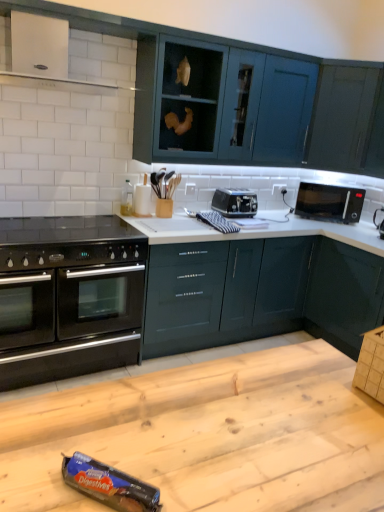
The image size is (384, 512). What are the coordinates of `glossy dark teal cabinets at center, which appears as the 3th cabinetry when viewed from the top` in the screenshot? It's located at (261, 293).

Describe the element at coordinates (348, 118) in the screenshot. The height and width of the screenshot is (512, 384). I see `glossy dark teal cabinet at upper right, marked as the fourth cabinetry in a bottom-to-top arrangement` at that location.

How much space does satin black toaster at center, which is the 1th appliance in back-to-front order, occupy vertically?

8.65 inches.

Find the location of a particular element. glossy dark teal cabinets at center, the second cabinetry ordered from the bottom is located at coordinates (261, 293).

Which of these two, glossy dark teal cabinets at center, the second cabinetry ordered from the bottom, or black plastic microwave at upper right, which is the first appliance from right to left, is smaller?

Smaller between the two is black plastic microwave at upper right, which is the first appliance from right to left.

Identify the location of appliance that is the 3rd object above the glossy dark teal cabinets at center, which appears as the 3th cabinetry when viewed from the top (from a real-world perspective). (379, 222).

Which object is thinner, glossy dark teal cabinets at center, the second cabinetry ordered from the bottom, or black plastic microwave at upper right, positioned as the second appliance in back-to-front order?

With smaller width is black plastic microwave at upper right, positioned as the second appliance in back-to-front order.

Is point (173, 315) closer to viewer compared to point (380, 222)?

Yes.

From the picture: Is blue cardboard digestives at lower center, marked as the 1th appliance in a front-to-back arrangement, bigger than satin black toaster at center, which is the third appliance in bottom-to-top order?

Actually, blue cardboard digestives at lower center, marked as the 1th appliance in a front-to-back arrangement, might be smaller than satin black toaster at center, which is the third appliance in bottom-to-top order.

Could you tell me if blue cardboard digestives at lower center, placed as the 3th appliance when sorted from right to left, is facing satin black toaster at center, which is the 1th appliance in back-to-front order?

No, blue cardboard digestives at lower center, placed as the 3th appliance when sorted from right to left, is not turned towards satin black toaster at center, which is the 1th appliance in back-to-front order.

From the image's perspective, which is above, blue cardboard digestives at lower center, the third appliance positioned from the top, or satin black toaster at center, which is the first appliance from top to bottom?

satin black toaster at center, which is the first appliance from top to bottom.

From the image's perspective, starting from the blue cardboard digestives at lower center, marked as the third appliance in a back-to-front arrangement, which appliance is the 2nd one above? Please provide its 2D coordinates.

[(235, 202)]

Is teal glossy cabinets at upper center, the third cabinetry from the bottom, not near glossy dark green cabinet at lower right, the 1th cabinetry from the bottom?

Absolutely, teal glossy cabinets at upper center, the third cabinetry from the bottom, is distant from glossy dark green cabinet at lower right, the 1th cabinetry from the bottom.

From the image's perspective, is teal glossy cabinets at upper center, arranged as the 2th cabinetry when viewed from the top, above glossy dark green cabinet at lower right, the 1th cabinetry from the bottom?

Yes, from the image's perspective, teal glossy cabinets at upper center, arranged as the 2th cabinetry when viewed from the top, is above glossy dark green cabinet at lower right, the 1th cabinetry from the bottom.

Is teal glossy cabinets at upper center, the third cabinetry from the bottom, looking in the opposite direction of glossy dark green cabinet at lower right, which is the 4th cabinetry in top-to-bottom order?

No, teal glossy cabinets at upper center, the third cabinetry from the bottom, is not facing away from glossy dark green cabinet at lower right, which is the 4th cabinetry in top-to-bottom order.

Considering the sizes of objects brown cardboard box at lower right and black glass gas stove at lower left in the image provided, who is thinner, brown cardboard box at lower right or black glass gas stove at lower left?

brown cardboard box at lower right.

Does brown cardboard box at lower right lie in front of black glass gas stove at lower left?

Yes, brown cardboard box at lower right is closer to the viewer.

Is point (371, 332) farther from viewer compared to point (66, 237)?

No, (371, 332) is closer to viewer.

From a real-world perspective, is brown cardboard box at lower right positioned over black glass gas stove at lower left based on gravity?

Yes, from a real-world perspective, brown cardboard box at lower right is above black glass gas stove at lower left.

From the image's perspective, is glossy dark green cabinet at lower right, the 1th cabinetry from the bottom, under black plastic microwave at upper right, the second appliance in the bottom-to-top sequence?

Indeed, from the image's perspective, glossy dark green cabinet at lower right, the 1th cabinetry from the bottom, is shown beneath black plastic microwave at upper right, the second appliance in the bottom-to-top sequence.

Which point is more forward, (358, 273) or (383, 218)?

Point (358, 273)

From a real-world perspective, is glossy dark green cabinet at lower right, the 1th cabinetry from the bottom, positioned above or below black plastic microwave at upper right, the 2th appliance when ordered from front to back?

glossy dark green cabinet at lower right, the 1th cabinetry from the bottom, is below black plastic microwave at upper right, the 2th appliance when ordered from front to back.

Which is more to the right, glossy dark green cabinet at lower right, which is the 4th cabinetry in top-to-bottom order, or black plastic microwave at upper right, the 2th appliance when ordered from front to back?

Positioned to the right is black plastic microwave at upper right, the 2th appliance when ordered from front to back.

From a real-world perspective, is glossy dark teal cabinets at center, which appears as the 3th cabinetry when viewed from the top, beneath glossy dark green cabinet at lower right, which is the 4th cabinetry in top-to-bottom order?

No, from a real-world perspective, glossy dark teal cabinets at center, which appears as the 3th cabinetry when viewed from the top, is not under glossy dark green cabinet at lower right, which is the 4th cabinetry in top-to-bottom order.

Does glossy dark teal cabinets at center, the second cabinetry ordered from the bottom, have a greater width compared to glossy dark green cabinet at lower right, which is the 4th cabinetry in top-to-bottom order?

In fact, glossy dark teal cabinets at center, the second cabinetry ordered from the bottom, might be narrower than glossy dark green cabinet at lower right, which is the 4th cabinetry in top-to-bottom order.

From the image's perspective, which is below, glossy dark teal cabinets at center, which appears as the 3th cabinetry when viewed from the top, or glossy dark green cabinet at lower right, the 1th cabinetry from the bottom?

glossy dark green cabinet at lower right, the 1th cabinetry from the bottom.

Consider the image. Is glossy dark teal cabinets at center, which appears as the 3th cabinetry when viewed from the top, facing towards glossy dark green cabinet at lower right, which is the 4th cabinetry in top-to-bottom order?

Yes, glossy dark teal cabinets at center, which appears as the 3th cabinetry when viewed from the top, is facing glossy dark green cabinet at lower right, which is the 4th cabinetry in top-to-bottom order.

From a real-world perspective, which object rests below the other?

black plastic microwave at upper right, which is counted as the 3th appliance, starting from the left, is physically lower.

Is black glossy microwave at upper right facing away from black plastic microwave at upper right, which is the first appliance from right to left?

That's not correct — black glossy microwave at upper right is not looking away from black plastic microwave at upper right, which is the first appliance from right to left.

Is point (299, 207) less distant than point (379, 224)?

No, (299, 207) is behind (379, 224).

Is black glossy microwave at upper right positioned far away from black plastic microwave at upper right, which is the first appliance from right to left?

Actually, black glossy microwave at upper right and black plastic microwave at upper right, which is the first appliance from right to left, are a little close together.

There is a glossy dark teal cabinets at center, the second cabinetry ordered from the bottom. Where is `the 1st appliance above it (from the image's perspective)`? Image resolution: width=384 pixels, height=512 pixels. the 1st appliance above it (from the image's perspective) is located at coordinates (379, 222).

Starting from the blue cardboard digestives at lower center, placed as the 3th appliance when sorted from right to left, which appliance is the 1st one to the right? Please provide its 2D coordinates.

[(235, 202)]

Looking at the image, which one is located further to wooden table at center, black matte oven at lower left or black glossy microwave at upper right?

Based on the image, black glossy microwave at upper right appears to be further to wooden table at center.

When comparing their distances from glossy dark teal cabinets at center, which appears as the 3th cabinetry when viewed from the top, does brown cardboard box at lower right or black matte oven at lower left seem further?

brown cardboard box at lower right is further to glossy dark teal cabinets at center, which appears as the 3th cabinetry when viewed from the top.

From the image, which object appears to be farther from glossy dark teal cabinet at upper right, which is the 1th cabinetry from top to bottom, wooden table at center or teal glossy cabinets at upper center, the third cabinetry from the bottom?

wooden table at center is positioned further to the anchor glossy dark teal cabinet at upper right, which is the 1th cabinetry from top to bottom.

Looking at the image, which one is located closer to wooden table at center, blue cardboard digestives at lower center, which is the first appliance in bottom-to-top order, or black plastic microwave at upper right, positioned as the second appliance in back-to-front order?

blue cardboard digestives at lower center, which is the first appliance in bottom-to-top order, is positioned closer to the anchor wooden table at center.

When comparing their distances from glossy dark teal cabinet at upper right, which is the 1th cabinetry from top to bottom, does wooden table at center or black glass gas stove at lower left seem further?

wooden table at center lies further to glossy dark teal cabinet at upper right, which is the 1th cabinetry from top to bottom, than the other object.

Estimate the real-world distances between objects in this image. Which object is closer to black glossy microwave at upper right, black matte oven at lower left or wooden table at center?

black matte oven at lower left lies closer to black glossy microwave at upper right than the other object.

Based on their spatial positions, is glossy dark green cabinet at lower right, which is the 4th cabinetry in top-to-bottom order, or glossy dark teal cabinets at center, which appears as the 3th cabinetry when viewed from the top, closer to black glass gas stove at lower left?

Among the two, glossy dark teal cabinets at center, which appears as the 3th cabinetry when viewed from the top, is located nearer to black glass gas stove at lower left.

Considering their positions, is glossy dark teal cabinet at upper right, which is the 1th cabinetry from top to bottom, positioned further to black matte oven at lower left than brown cardboard box at lower right?

glossy dark teal cabinet at upper right, which is the 1th cabinetry from top to bottom.

In order to click on appliance between teal glossy cabinets at upper center, the third cabinetry from the bottom, and glossy dark teal cabinet at upper right, marked as the fourth cabinetry in a bottom-to-top arrangement, from left to right in this screenshot , I will do (235, 202).

Where is `gas stove positioned between wooden table at center and black glossy microwave at upper right from near to far`? This screenshot has height=512, width=384. gas stove positioned between wooden table at center and black glossy microwave at upper right from near to far is located at coordinates (66, 230).

The width and height of the screenshot is (384, 512). What are the coordinates of `cabinetry between black glass gas stove at lower left and glossy dark teal cabinets at center, which appears as the 3th cabinetry when viewed from the top` in the screenshot? It's located at (242, 99).

This screenshot has height=512, width=384. Identify the location of cardboard box between blue cardboard digestives at lower center, marked as the third appliance in a back-to-front arrangement, and satin black toaster at center, which is the 2th appliance in right-to-left order, in the front-back direction. (371, 365).